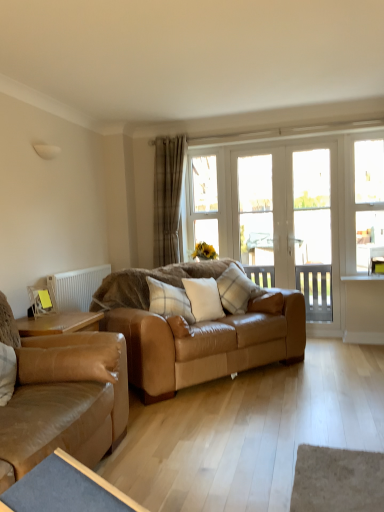
Question: Is clear glass screen door at right, acting as the second screen door starting from the left, far from white soft cushion at center, the second pillow positioned from the right?

Choices:
 (A) yes
 (B) no

Answer: (A)

Question: Can you confirm if clear glass screen door at right, which is the first screen door from right to left, is positioned to the right of white soft cushion at center, acting as the second pillow starting from the left?

Choices:
 (A) no
 (B) yes

Answer: (B)

Question: Considering the relative positions of clear glass screen door at right, which is the first screen door from right to left, and white soft cushion at center, the second pillow positioned from the right, in the image provided, is clear glass screen door at right, which is the first screen door from right to left, behind white soft cushion at center, the second pillow positioned from the right,?

Choices:
 (A) yes
 (B) no

Answer: (A)

Question: Is white soft cushion at center, the second pillow positioned from the right, at the back of clear glass screen door at right, which is the first screen door from right to left?

Choices:
 (A) yes
 (B) no

Answer: (B)

Question: From a real-world perspective, is clear glass screen door at right, which is the first screen door from right to left, positioned under white soft cushion at center, the second pillow positioned from the right, based on gravity?

Choices:
 (A) yes
 (B) no

Answer: (B)

Question: Looking at their shapes, would you say clear glass door at center, which appears as the second window when viewed from the left, is wider or thinner than blue fabric table at lower left?

Choices:
 (A) thin
 (B) wide

Answer: (A)

Question: Considering the relative positions of clear glass door at center, the second window viewed from the right, and blue fabric table at lower left in the image provided, is clear glass door at center, the second window viewed from the right, to the left or to the right of blue fabric table at lower left?

Choices:
 (A) right
 (B) left

Answer: (A)

Question: From a real-world perspective, is clear glass door at center, the second window viewed from the right, positioned above or below blue fabric table at lower left?

Choices:
 (A) below
 (B) above

Answer: (B)

Question: Is point (269, 181) closer or farther from the camera than point (66, 483)?

Choices:
 (A) closer
 (B) farther

Answer: (B)

Question: Is clear glass door at center, which appears as the second window when viewed from the left, wider or thinner than leather couch at center, which appears as the second studio couch when viewed from the front?

Choices:
 (A) thin
 (B) wide

Answer: (A)

Question: In the image, is clear glass door at center, which appears as the second window when viewed from the left, on the left side or the right side of leather couch at center, which is the first studio couch in back-to-front order?

Choices:
 (A) left
 (B) right

Answer: (B)

Question: Considering their positions, is clear glass door at center, which appears as the second window when viewed from the left, located in front of or behind leather couch at center, which is the first studio couch in back-to-front order?

Choices:
 (A) front
 (B) behind

Answer: (B)

Question: Is point (271, 198) closer or farther from the camera than point (200, 380)?

Choices:
 (A) closer
 (B) farther

Answer: (B)

Question: Based on their positions, is clear glass window at center, which is the third window from right to left, located to the left or right of beige plaid curtain at center?

Choices:
 (A) left
 (B) right

Answer: (B)

Question: Is clear glass window at center, which ranks as the first window in left-to-right order, in front of or behind beige plaid curtain at center in the image?

Choices:
 (A) behind
 (B) front

Answer: (A)